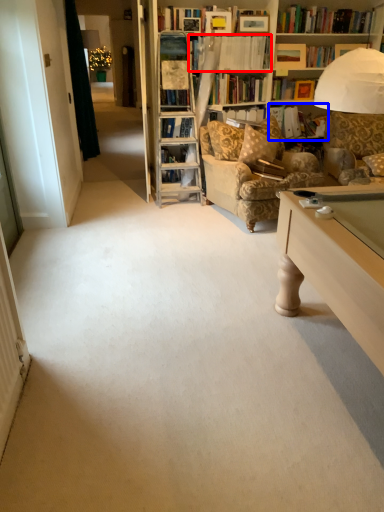
Question: Which object is closer to the camera taking this photo, book (highlighted by a red box) or book (highlighted by a blue box)?

Choices:
 (A) book
 (B) book

Answer: (A)